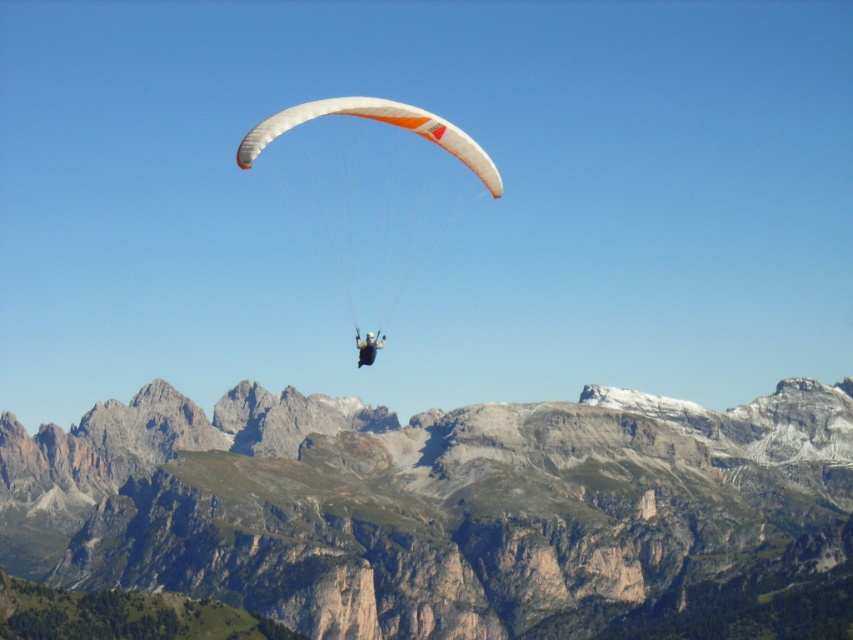
You are a pilot trying to navigate between two landmarks. You see a rugged stone mountain range at center and a matte black paraglider at center. Which one is located to the right side of the other?

The rugged stone mountain range at center is positioned on the right side of matte black paraglider at center.

You are a photographer planning to capture the rugged stone mountain range at center and the white matte parachute at center in a single frame. Based on the scene, which object will occupy more horizontal space in your photo?

The rugged stone mountain range at center will occupy more horizontal space in the photo because its width surpasses that of the white matte parachute at center.